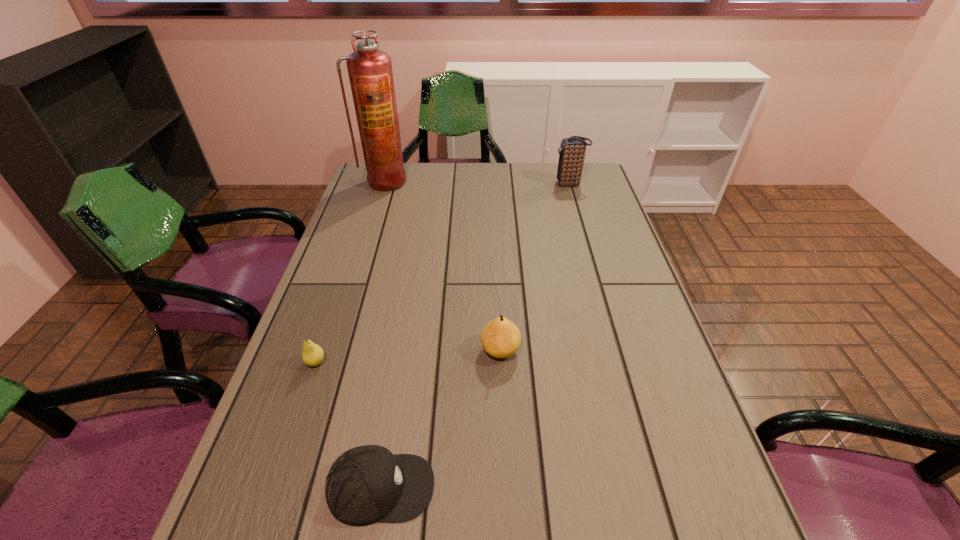
Find the location of a particular element. object that is at the far left corner is located at coordinates (370, 72).

This screenshot has height=540, width=960. What are the coordinates of `object situated at the far right corner` in the screenshot? It's located at (572, 151).

Where is `free location at the far edge of the desktop`? This screenshot has height=540, width=960. free location at the far edge of the desktop is located at coordinates (421, 163).

Where is `vacant area at the left edge of the desktop`? This screenshot has height=540, width=960. vacant area at the left edge of the desktop is located at coordinates (359, 353).

In the image, there is a desktop. In order to click on vacant space at the right edge in this screenshot , I will do pyautogui.click(x=580, y=201).

Locate an element on the screen. free area in between the shorter pear and the fire extinguisher is located at coordinates (350, 272).

This screenshot has height=540, width=960. Find the location of `free area in between the shorter pear and the nearest object`. free area in between the shorter pear and the nearest object is located at coordinates (348, 425).

This screenshot has height=540, width=960. Find the location of `vacant space that is in between the shorter pear and the third shortest object`. vacant space that is in between the shorter pear and the third shortest object is located at coordinates (408, 356).

Locate an element on the screen. Image resolution: width=960 pixels, height=540 pixels. vacant space in between the left pear and the tallest object is located at coordinates (350, 272).

This screenshot has height=540, width=960. I want to click on empty location between the second object from right to left and the tallest object, so coord(443,266).